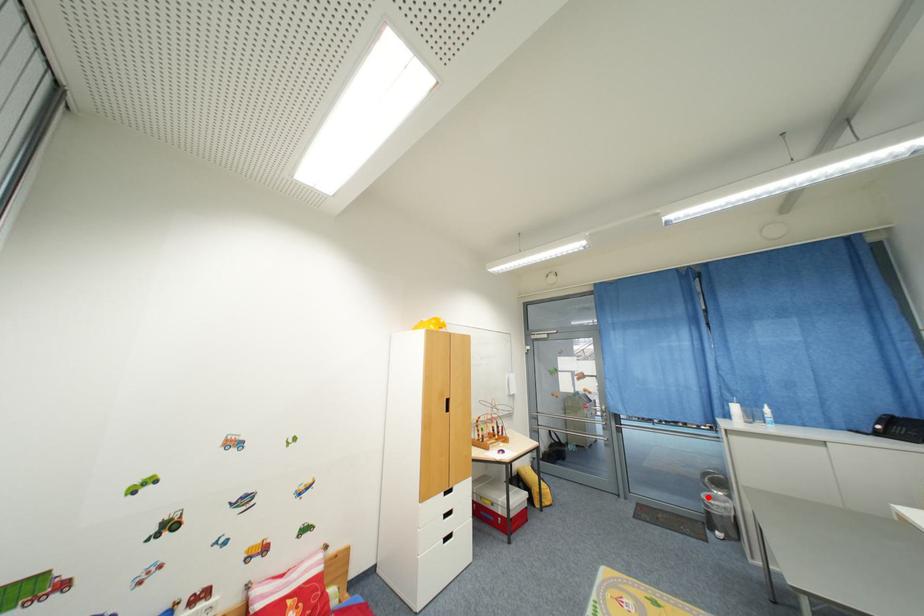
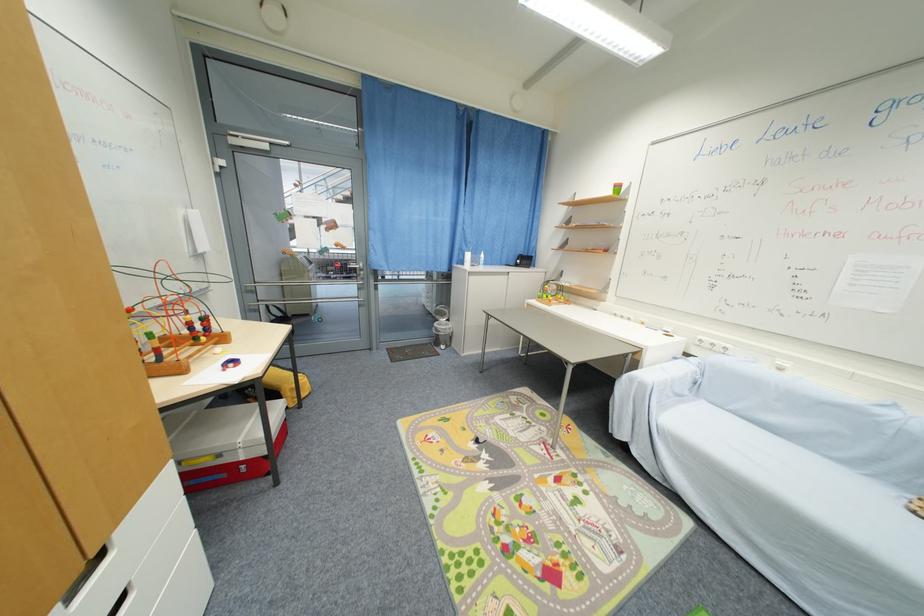
In the second image, find the point that corresponds to the highlighted location in the first image.

(441, 326)